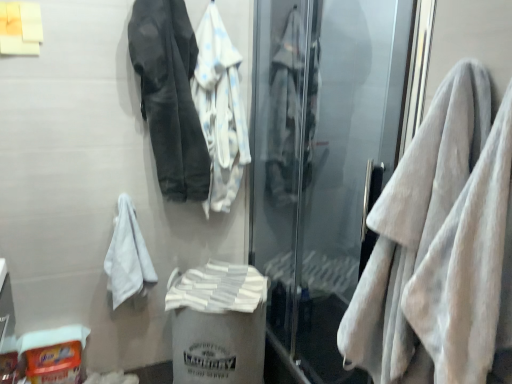
Question: Is dark gray fabric jacket at upper left, the 1th jacket viewed from the left, to the right of white plastic bag at center, arranged as the second garbage when viewed from the left, from the viewer's perspective?

Choices:
 (A) no
 (B) yes

Answer: (A)

Question: Would you say dark gray fabric jacket at upper left, the 1th jacket viewed from the left, is outside white plastic bag at center, arranged as the second garbage when viewed from the left?

Choices:
 (A) no
 (B) yes

Answer: (B)

Question: Is dark gray fabric jacket at upper left, the 1th jacket viewed from the left, in front of white plastic bag at center, arranged as the second garbage when viewed from the left?

Choices:
 (A) yes
 (B) no

Answer: (A)

Question: Is dark gray fabric jacket at upper left, the second jacket positioned from the right, oriented away from white plastic bag at center, arranged as the second garbage when viewed from the left?

Choices:
 (A) yes
 (B) no

Answer: (B)

Question: Considering the relative sizes of dark gray fabric jacket at upper left, the 1th jacket viewed from the left, and white plastic bag at center, arranged as the second garbage when viewed from the left, in the image provided, is dark gray fabric jacket at upper left, the 1th jacket viewed from the left, taller than white plastic bag at center, arranged as the second garbage when viewed from the left,?

Choices:
 (A) yes
 (B) no

Answer: (A)

Question: Would you say white cotton towel at center is inside or outside transparent glass screen door at right?

Choices:
 (A) inside
 (B) outside

Answer: (B)

Question: Considering their positions, is white cotton towel at center located in front of or behind transparent glass screen door at right?

Choices:
 (A) behind
 (B) front

Answer: (A)

Question: Is point (266, 190) closer or farther from the camera than point (309, 168)?

Choices:
 (A) closer
 (B) farther

Answer: (B)

Question: Considering the positions of white cotton towel at center and transparent glass screen door at right in the image, is white cotton towel at center taller or shorter than transparent glass screen door at right?

Choices:
 (A) short
 (B) tall

Answer: (A)

Question: Looking at the image, does white fluffy towel at right, which is the first towel from front to back, seem bigger or smaller compared to transparent glass screen door at right?

Choices:
 (A) small
 (B) big

Answer: (A)

Question: From a real-world perspective, is white fluffy towel at right, which is the first towel from front to back, physically located above or below transparent glass screen door at right?

Choices:
 (A) below
 (B) above

Answer: (B)

Question: Considering the positions of white fluffy towel at right, the second towel viewed from the left, and transparent glass screen door at right in the image, is white fluffy towel at right, the second towel viewed from the left, taller or shorter than transparent glass screen door at right?

Choices:
 (A) tall
 (B) short

Answer: (B)

Question: Is point (445, 316) positioned closer to the camera than point (310, 178)?

Choices:
 (A) farther
 (B) closer

Answer: (B)

Question: From the image's perspective, relative to dark gray fabric jacket at upper left, the second jacket positioned from the right, is white soft bath towel at center above or below?

Choices:
 (A) below
 (B) above

Answer: (A)

Question: Is white soft bath towel at center situated inside dark gray fabric jacket at upper left, the 1th jacket viewed from the left, or outside?

Choices:
 (A) inside
 (B) outside

Answer: (B)